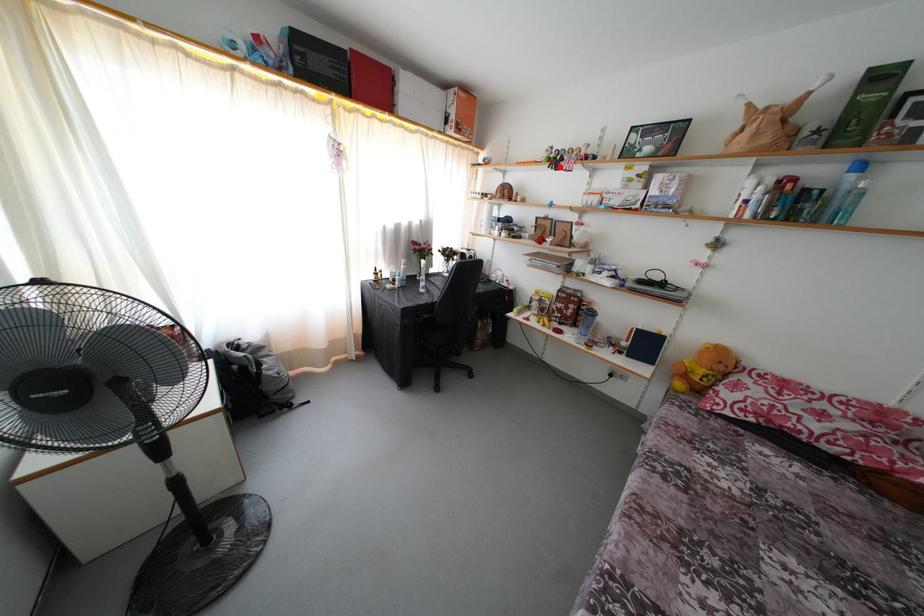
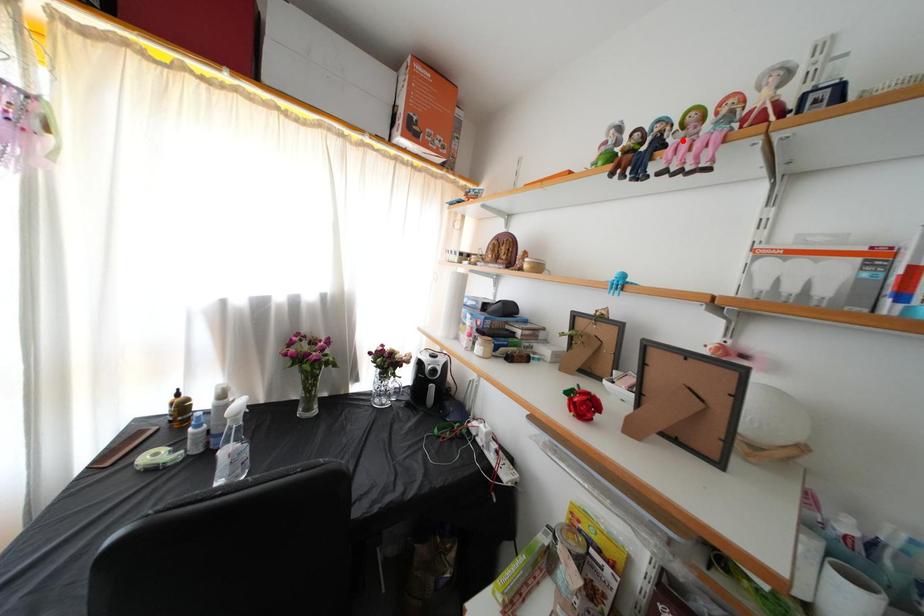
I am providing you with two images of the same scene from different viewpoints. A red point is marked on the first image and another point is marked on the second image. Does the point marked in image1 correspond to the same location as the one in image2?

No